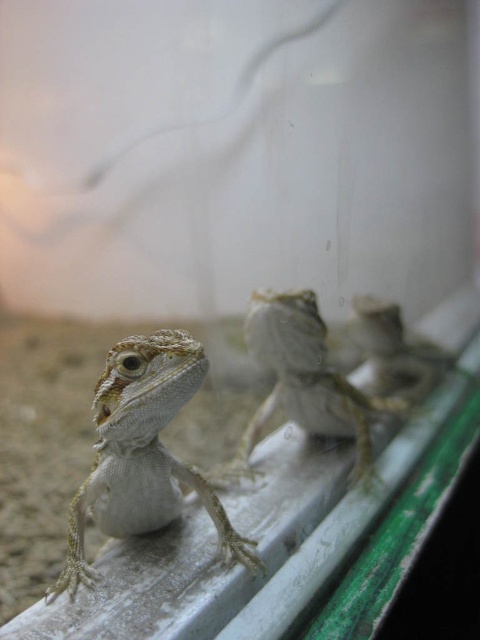
Does white matte lizard at center appear over smooth beige lizard at center?

No.

Image resolution: width=480 pixels, height=640 pixels. What do you see at coordinates (143, 452) in the screenshot?
I see `white matte lizard at center` at bounding box center [143, 452].

I want to click on white matte lizard at center, so click(x=143, y=452).